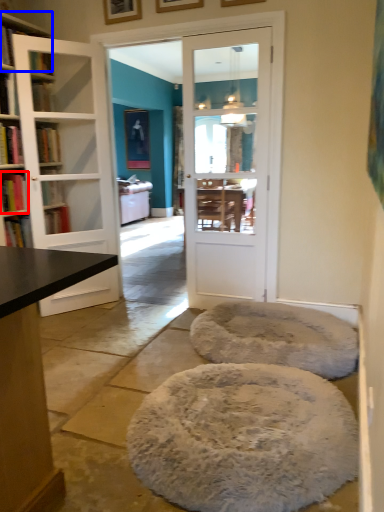
Question: Which object is closer to the camera taking this photo, book (highlighted by a red box) or shelf (highlighted by a blue box)?

Choices:
 (A) book
 (B) shelf

Answer: (B)